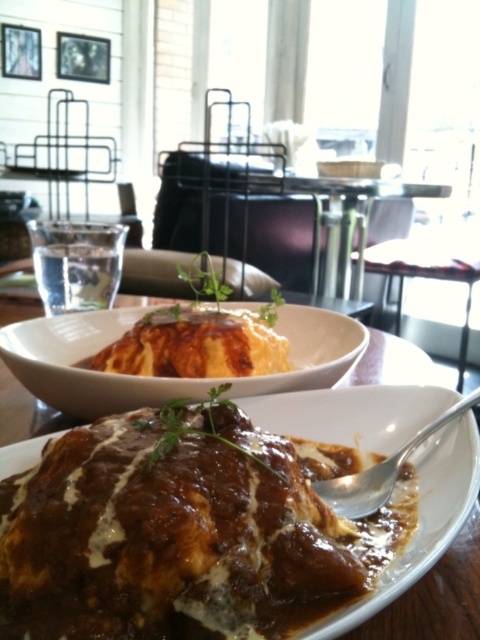
Does saucy brown meat at center have a greater width compared to silver spoon at lower right?

Yes.

Which of these two, saucy brown meat at center or silver spoon at lower right, stands shorter?

Standing shorter between the two is silver spoon at lower right.

Where is `saucy brown meat at center`? This screenshot has height=640, width=480. saucy brown meat at center is located at coordinates (184, 532).

Which is more to the left, saucy brown meat at center or white glossy bowl at upper center?

white glossy bowl at upper center is more to the left.

Is saucy brown meat at center closer to camera compared to white glossy bowl at upper center?

Yes.

Measure the distance between point (x=395, y=545) and camera.

Point (x=395, y=545) and camera are 12.31 inches apart from each other.

Find the location of `saucy brown meat at center`. saucy brown meat at center is located at coordinates (184, 532).

In the scene shown: Is white glossy bowl at upper center below silver spoon at lower right?

No.

Can you confirm if white glossy bowl at upper center is wider than silver spoon at lower right?

Yes, white glossy bowl at upper center is wider than silver spoon at lower right.

You are a GUI agent. You are given a task and a screenshot of the screen. Output one action in this format:
    pyautogui.click(x=<x>, y=<y>)
    Task: Click on the white glossy bowl at upper center
    This screenshot has width=480, height=640.
    Given the screenshot: What is the action you would take?
    pyautogui.click(x=165, y=378)